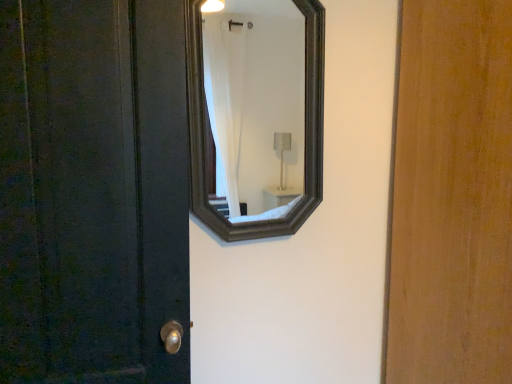
Find the location of a particular element. dark wood mirror at center is located at coordinates (255, 99).

Describe the element at coordinates (255, 99) in the screenshot. The width and height of the screenshot is (512, 384). I see `dark wood mirror at center` at that location.

Find the location of a particular element. This screenshot has width=512, height=384. dark wood mirror at center is located at coordinates (255, 99).